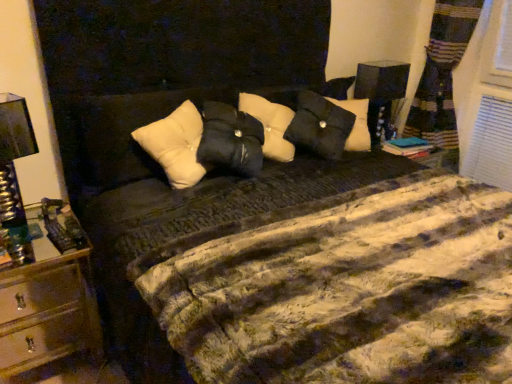
Question: Is metallic gold nightstand at left wider or thinner than black fabric lampshade at upper right, the first bedside lamp from the top?

Choices:
 (A) wide
 (B) thin

Answer: (A)

Question: From a real-world perspective, is metallic gold nightstand at left above or below black fabric lampshade at upper right, the second bedside lamp when ordered from front to back?

Choices:
 (A) below
 (B) above

Answer: (A)

Question: Based on their relative distances, which object is nearer to the metallic silver lamp at left, which is the first bedside lamp in left-to-right order?

Choices:
 (A) black fabric lampshade at upper right, the first bedside lamp from the top
 (B) white soft pillow at center
 (C) metallic gold nightstand at left

Answer: (C)

Question: Which of these objects is positioned closest to the metallic silver lamp at left, which ranks as the 2th bedside lamp in back-to-front order?

Choices:
 (A) metallic gold nightstand at left
 (B) black fabric lampshade at upper right, acting as the second bedside lamp starting from the left
 (C) white soft pillow at center

Answer: (A)